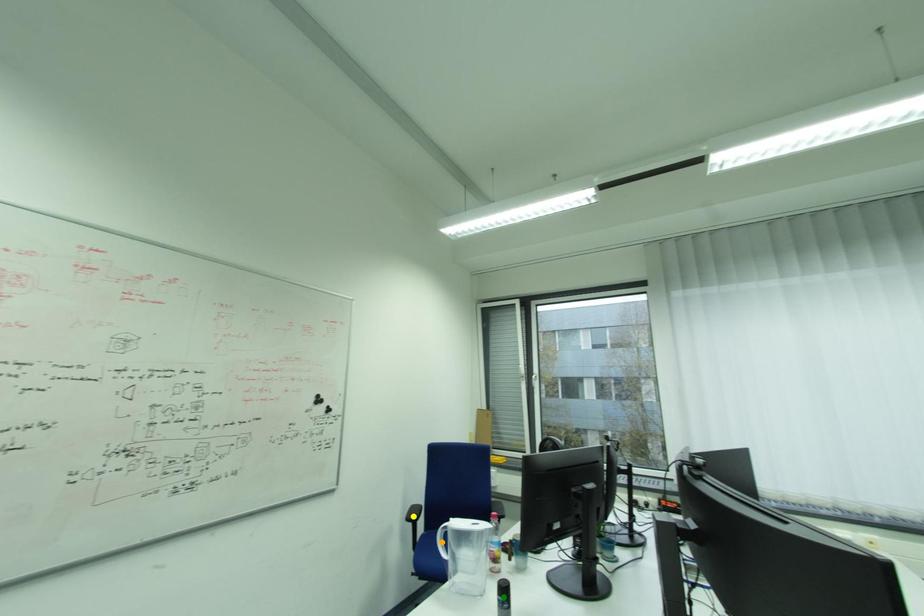
Order these from nearest to farthest:
1. yellow point
2. green point
3. orange point

green point, orange point, yellow point